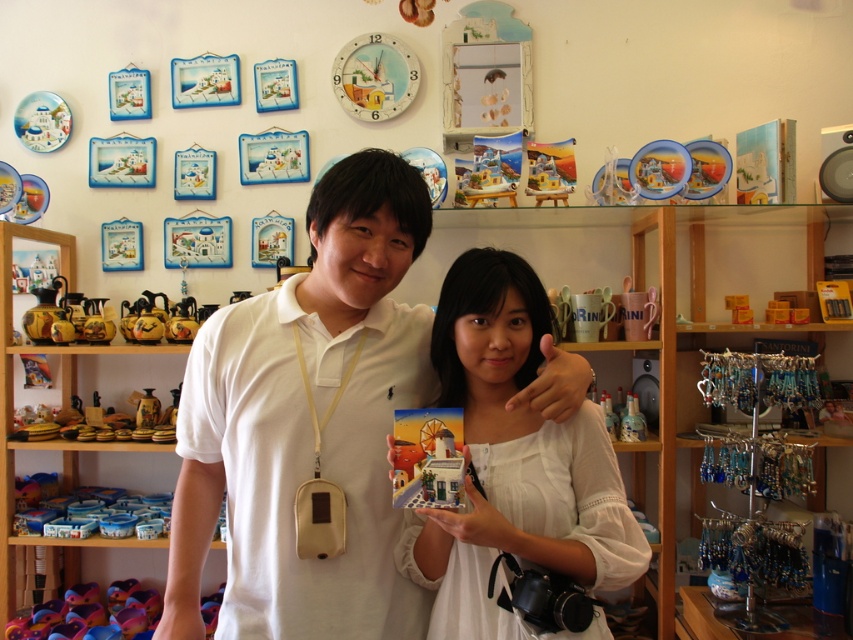
Does white matte shirt at center have a smaller size compared to white matte card at center?

No.

Does point (392, 269) lie in front of point (419, 528)?

Yes, point (392, 269) is closer to viewer.

Locate an element on the screen. The height and width of the screenshot is (640, 853). white matte shirt at center is located at coordinates [x=308, y=422].